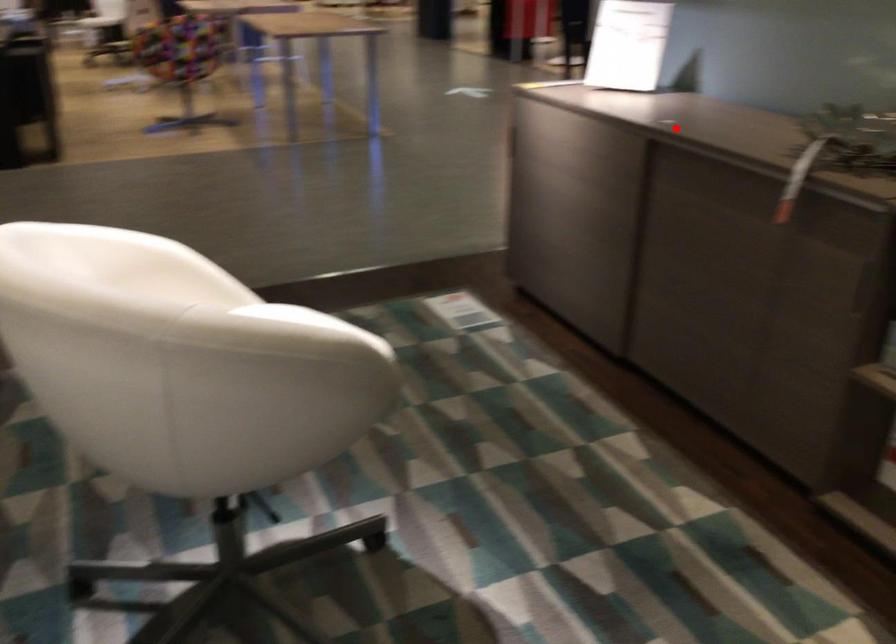
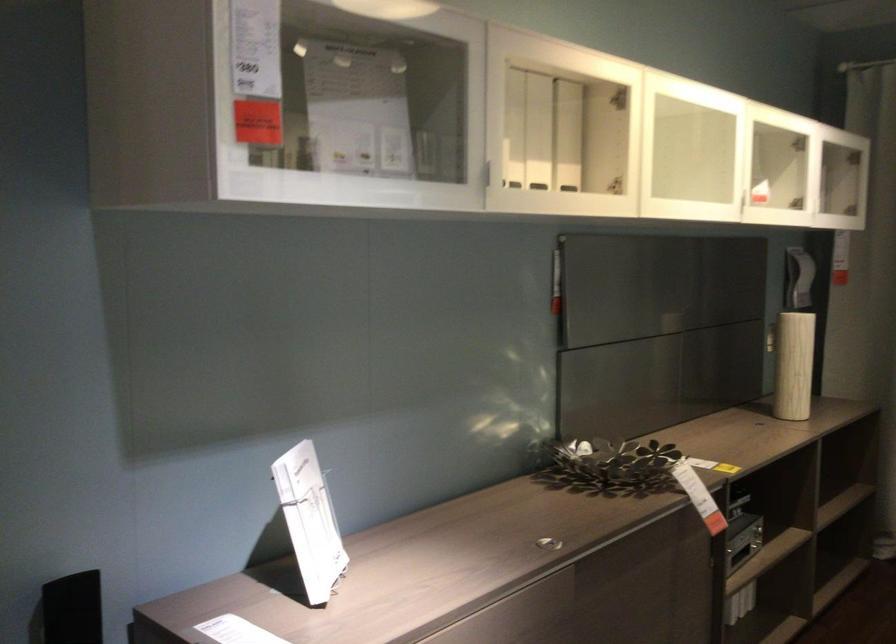
The point at the highlighted location is marked in the first image. Where is the corresponding point in the second image?

(547, 543)